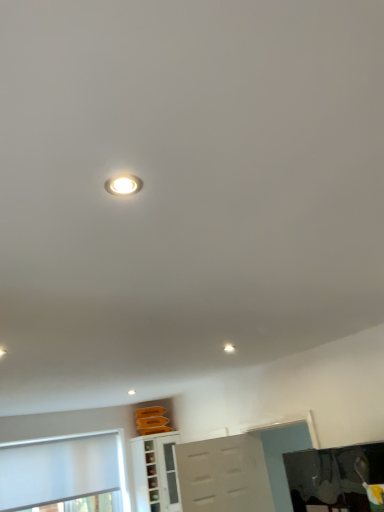
Question: Is white matte window at lower left in contact with white glossy droplight at center?

Choices:
 (A) yes
 (B) no

Answer: (B)

Question: From a real-world perspective, is white matte window at lower left physically above white glossy droplight at center?

Choices:
 (A) yes
 (B) no

Answer: (B)

Question: Does white matte window at lower left come behind white glossy droplight at center?

Choices:
 (A) yes
 (B) no

Answer: (A)

Question: Does white matte window at lower left have a greater width compared to white glossy droplight at center?

Choices:
 (A) yes
 (B) no

Answer: (A)

Question: Is white matte window at lower left far away from white glossy droplight at center?

Choices:
 (A) no
 (B) yes

Answer: (B)

Question: Is white matte window at lower left positioned in front of white glossy droplight at center?

Choices:
 (A) no
 (B) yes

Answer: (A)

Question: From the image's perspective, is white glossy cabinet at lower center located above white matte window at lower left?

Choices:
 (A) yes
 (B) no

Answer: (B)

Question: Is white glossy cabinet at lower center bigger than white matte window at lower left?

Choices:
 (A) no
 (B) yes

Answer: (B)

Question: Is white glossy cabinet at lower center far away from white matte window at lower left?

Choices:
 (A) yes
 (B) no

Answer: (B)

Question: Are white glossy cabinet at lower center and white matte window at lower left making contact?

Choices:
 (A) no
 (B) yes

Answer: (A)

Question: Would you say white glossy cabinet at lower center contains white matte window at lower left?

Choices:
 (A) yes
 (B) no

Answer: (B)

Question: Is white glossy cabinet at lower center positioned with its back to white matte window at lower left?

Choices:
 (A) no
 (B) yes

Answer: (A)

Question: Does white matte window at lower left have a smaller size compared to white glossy cabinet at lower center?

Choices:
 (A) yes
 (B) no

Answer: (A)